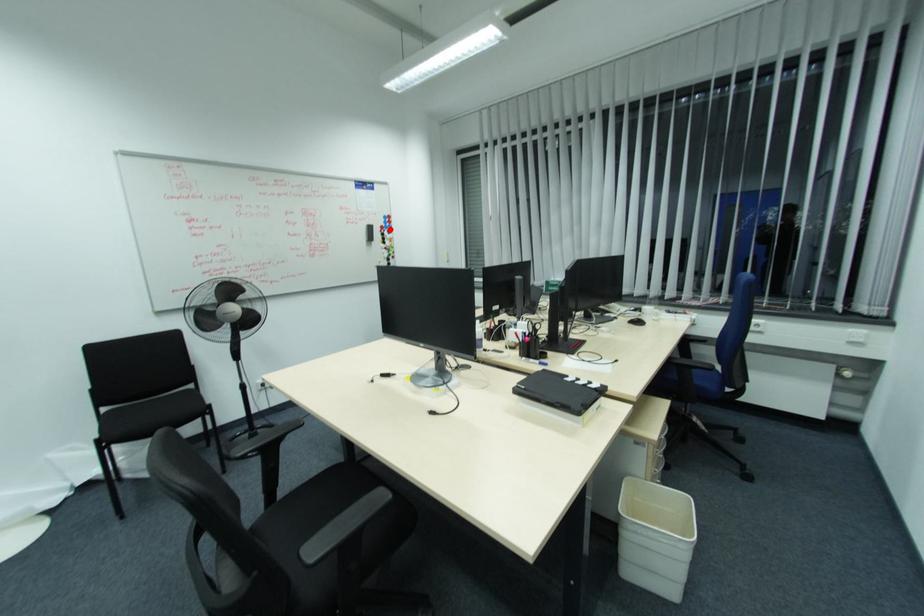
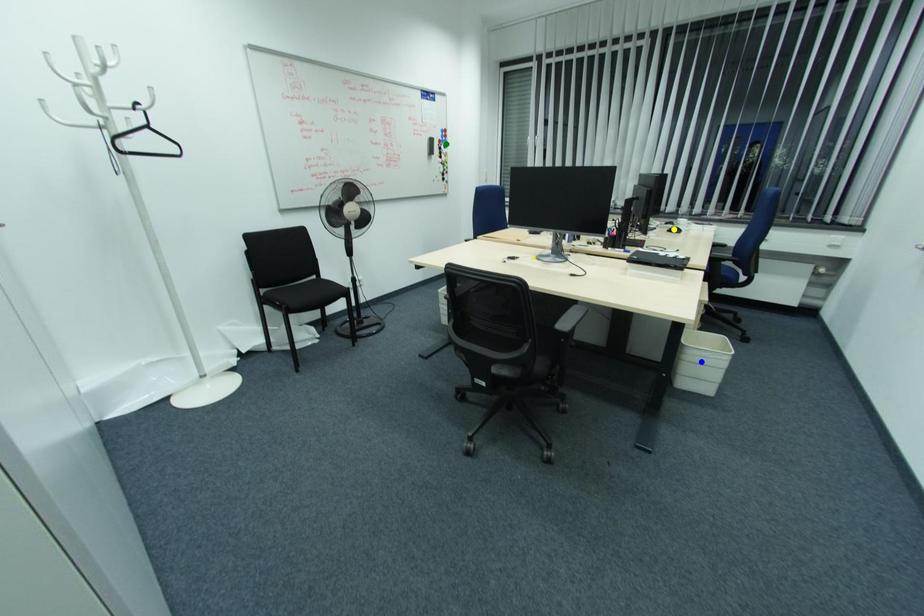
Question: I am providing you with two images of the same scene from different viewpoints. A red point is marked on the first image. You are given multiple points on the second image. Can you choose the point in image 2 that corresponds to the point in image 1?

Choices:
 (A) yellow point
 (B) blue point
 (C) green point

Answer: (C)